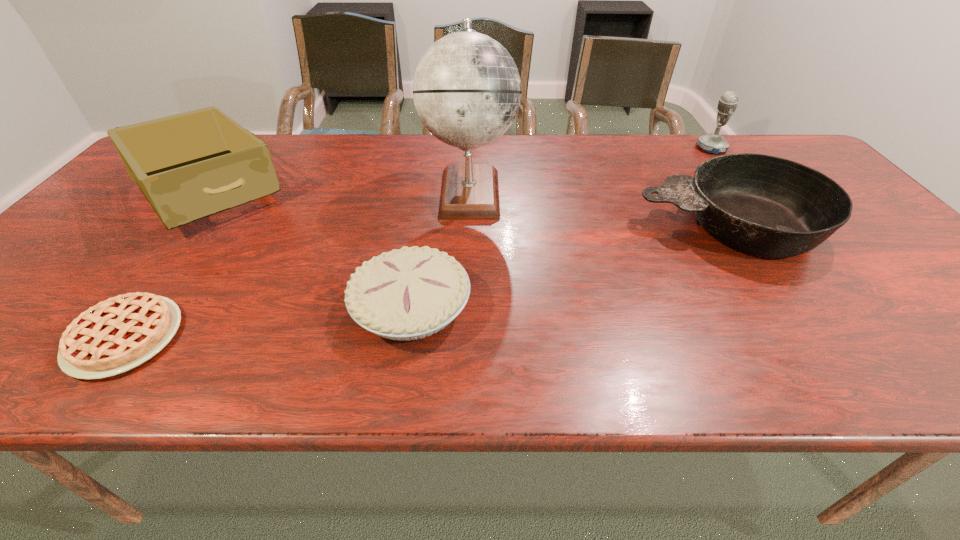
The image size is (960, 540). Identify the location of vacant space that is in between the frying pan and the globe. (598, 209).

Locate an element on the screen. The image size is (960, 540). vacant point located between the shorter pie and the taller pie is located at coordinates (268, 322).

This screenshot has height=540, width=960. Find the location of `free spot between the left pie and the tallest object`. free spot between the left pie and the tallest object is located at coordinates (298, 265).

This screenshot has height=540, width=960. Identify the location of empty space between the tallest object and the taller pie. (441, 249).

Identify the location of unoccupied area between the tallest object and the fifth tallest object. (441, 249).

Locate an element on the screen. The image size is (960, 540). unoccupied position between the frying pan and the taller pie is located at coordinates (569, 266).

Identify which object is located as the second nearest to the box. Please provide its 2D coordinates. Your answer should be formatted as a tuple, i.e. [(x, y)], where the tuple contains the x and y coordinates of a point satisfying the conditions above.

[(410, 293)]

Identify the location of object identified as the second closest to the microphone. (467, 91).

The width and height of the screenshot is (960, 540). I want to click on free region that satisfies the following two spatial constraints: 1. with the handle extending from the side of the fourth tallest object; 2. at the equator of the globe, so click(x=705, y=192).